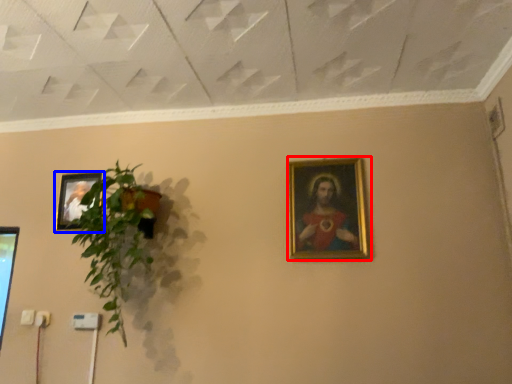
Question: Which of the following is the closest to the observer, picture frame (highlighted by a red box) or picture frame (highlighted by a blue box)?

Choices:
 (A) picture frame
 (B) picture frame

Answer: (A)